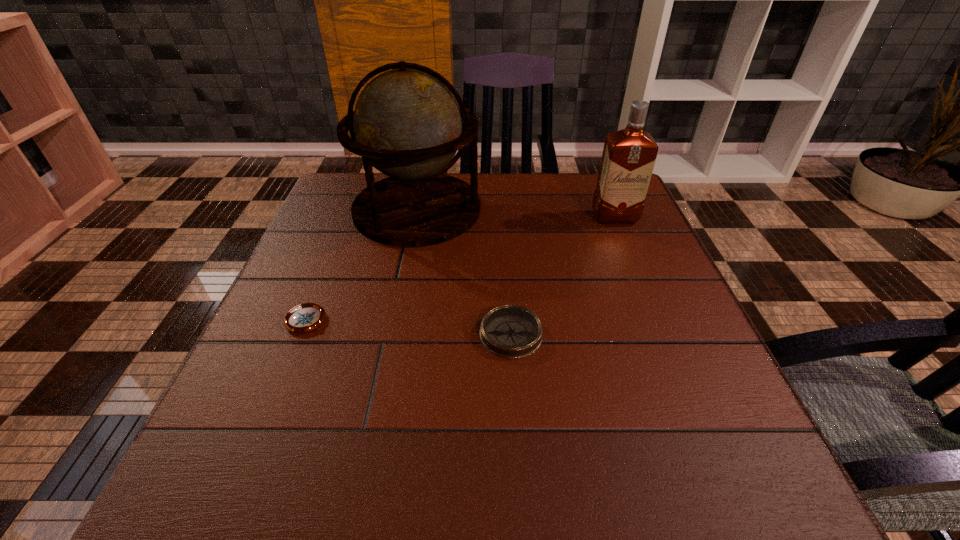
Identify the location of vacant position at the right edge of the desktop. The height and width of the screenshot is (540, 960). (650, 264).

Image resolution: width=960 pixels, height=540 pixels. In order to click on blank space at the far right corner in this screenshot , I will do 577,187.

Where is `free space between the left compass and the tallest object`? free space between the left compass and the tallest object is located at coordinates (362, 265).

Identify the location of free area in between the liquor and the left compass. The image size is (960, 540). (461, 269).

This screenshot has width=960, height=540. In order to click on empty location between the liquor and the taller compass in this screenshot , I will do coord(563,276).

The image size is (960, 540). Identify the location of free space between the shortest object and the third shortest object. (461, 269).

Where is `free space between the third tallest object and the shorter compass`? The width and height of the screenshot is (960, 540). free space between the third tallest object and the shorter compass is located at coordinates (409, 327).

In order to click on vacant point located between the globe and the right compass in this screenshot , I will do `click(465, 272)`.

Where is `vacant area that lies between the liquor and the shortest object`? vacant area that lies between the liquor and the shortest object is located at coordinates 461,269.

At what (x,y) coordinates should I click in order to perform the action: click on empty space that is in between the right compass and the shorter compass. Please return your answer as a coordinate pair (x, y). Looking at the image, I should click on (409, 327).